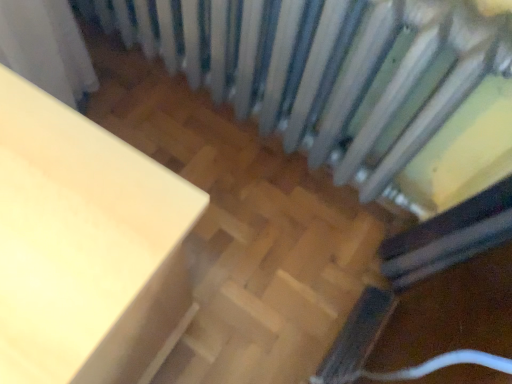
Question: Relative to white painted radiator at upper center, is matte white table at left in front or behind?

Choices:
 (A) front
 (B) behind

Answer: (A)

Question: Does point (24, 327) appear closer or farther from the camera than point (359, 114)?

Choices:
 (A) farther
 (B) closer

Answer: (B)

Question: Visually, is matte white table at left positioned to the left or to the right of white painted radiator at upper center?

Choices:
 (A) right
 (B) left

Answer: (B)

Question: From the image's perspective, is white painted radiator at upper center positioned above or below matte white table at left?

Choices:
 (A) below
 (B) above

Answer: (B)

Question: Is white painted radiator at upper center in front of or behind matte white table at left in the image?

Choices:
 (A) front
 (B) behind

Answer: (B)

Question: Considering the positions of white painted radiator at upper center and matte white table at left in the image, is white painted radiator at upper center wider or thinner than matte white table at left?

Choices:
 (A) thin
 (B) wide

Answer: (A)

Question: From a real-world perspective, is white painted radiator at upper center physically located above or below matte white table at left?

Choices:
 (A) below
 (B) above

Answer: (B)